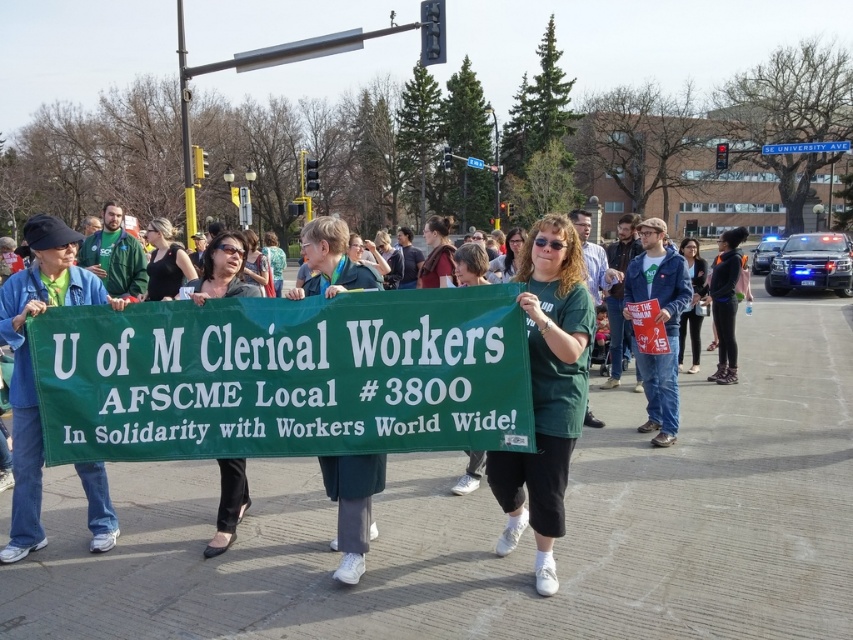
Consider the image. You are a photographer standing at the camera position. You want to capture a closeup shot of the green fabric banner at center. Considering the banner is 15.71 feet away, is it within the typical focus range of a standard camera lens?

The green fabric banner at center is 15.71 feet away from the camera. A standard camera lens typically has a focus range that can handle distances well beyond 15 feet, so it should be within the focus range for a clear closeup shot.

You are a photographer standing at the edge of the protest crowd. You want to take a photo of the black fabric shirt at center and dark blue jeans at center in the same frame. Given that your camera has a maximum focus range of 6 meters, will you be able to capture both subjects clearly in one shot?

The distance between the black fabric shirt at center and dark blue jeans at center is 6.23 meters, which exceeds the camera maximum focus range of 6 meters. Therefore, you cannot capture both subjects clearly in one shot.

You are part of the protest group and need to adjust the banner for a photo. The photographer wants the black fabric shirt at center to be positioned to the left of the green fabric banner at center. Is the current arrangement already meeting this requirement?

Yes, the current arrangement already meets the requirement because the green fabric banner at center is to the right of the black fabric shirt at center, which means the black fabric shirt at center is positioned to the left of the green fabric banner at center.